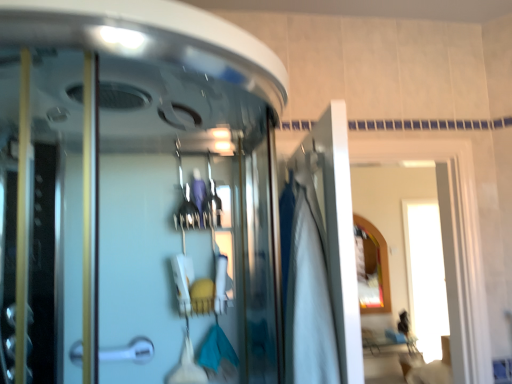
This screenshot has height=384, width=512. What do you see at coordinates (375, 265) in the screenshot? I see `matte gold mirror at upper right` at bounding box center [375, 265].

Where is `transparent glass shower door at center`? transparent glass shower door at center is located at coordinates (131, 216).

From the picture: What is the approximate width of white fabric at center?

5.36 inches.

Identify the location of matte gold mirror at upper right. The image size is (512, 384). (375, 265).

Considering the relative sizes of silver metallic door handle at lower left and matte gold mirror at upper right in the image provided, is silver metallic door handle at lower left thinner than matte gold mirror at upper right?

No, silver metallic door handle at lower left is not thinner than matte gold mirror at upper right.

Considering the relative sizes of silver metallic door handle at lower left and matte gold mirror at upper right in the image provided, is silver metallic door handle at lower left shorter than matte gold mirror at upper right?

Correct, silver metallic door handle at lower left is not as tall as matte gold mirror at upper right.

From the image's perspective, which one is positioned higher, silver metallic door handle at lower left or matte gold mirror at upper right?

silver metallic door handle at lower left is shown above in the image.

Can matte gold mirror at upper right be found inside silver metallic door handle at lower left?

No, matte gold mirror at upper right is not surrounded by silver metallic door handle at lower left.

Can you confirm if white glossy door at upper right is wider than matte gold mirror at upper right?

Yes, white glossy door at upper right is wider than matte gold mirror at upper right.

Is white glossy door at upper right shorter than matte gold mirror at upper right?

Yes.

Based on the photo, is white glossy door at upper right to the left or to the right of matte gold mirror at upper right in the image?

white glossy door at upper right is to the left of matte gold mirror at upper right.

Can you confirm if white fabric at center is shorter than matte gold mirror at upper right?

Correct, white fabric at center is not as tall as matte gold mirror at upper right.

Is point (319, 323) in front of point (355, 216)?

Yes, point (319, 323) is closer to viewer.

Between white fabric at center and matte gold mirror at upper right, which one has larger width?

Wider between the two is white fabric at center.

From the image's perspective, who appears lower, white fabric at center or matte gold mirror at upper right?

matte gold mirror at upper right appears lower in the image.

Is white fabric at center taller than silver metallic door handle at lower left?

Indeed, white fabric at center has a greater height compared to silver metallic door handle at lower left.

Is white fabric at center not within silver metallic door handle at lower left?

white fabric at center is positioned outside silver metallic door handle at lower left.

Is point (353, 280) closer or farther from the camera than point (111, 350)?

Clearly, point (353, 280) is closer to the camera than point (111, 350).

From a real-world perspective, relative to silver metallic door handle at lower left, is white fabric at center vertically above or below?

In terms of real-world spatial position, white fabric at center is above silver metallic door handle at lower left.

Considering the relative positions of matte gold mirror at upper right and transparent glass shower door at center in the image provided, is matte gold mirror at upper right to the left of transparent glass shower door at center from the viewer's perspective?

No, matte gold mirror at upper right is not to the left of transparent glass shower door at center.

Is point (374, 255) farther from viewer compared to point (33, 328)?

That is True.

Which of these two, matte gold mirror at upper right or transparent glass shower door at center, is thinner?

Thinner between the two is matte gold mirror at upper right.

Based on the photo, can you confirm if white glossy door at upper right is thinner than silver metallic door handle at lower left?

No, white glossy door at upper right is not thinner than silver metallic door handle at lower left.

Based on the photo, in terms of size, does white glossy door at upper right appear bigger or smaller than silver metallic door handle at lower left?

In the image, white glossy door at upper right appears to be larger than silver metallic door handle at lower left.

Is silver metallic door handle at lower left at the back of white glossy door at upper right?

That's not correct — white glossy door at upper right is not looking away from silver metallic door handle at lower left.

Does white glossy door at upper right contain silver metallic door handle at lower left?

No, silver metallic door handle at lower left is located outside of white glossy door at upper right.

Is white fabric at center in front of transparent glass shower door at center?

No, white fabric at center is behind transparent glass shower door at center.

From a real-world perspective, who is located lower, white fabric at center or transparent glass shower door at center?

white fabric at center, from a real-world perspective.

Is white fabric at center not near transparent glass shower door at center?

white fabric at center is near transparent glass shower door at center, not far away.

How far apart are white fabric at center and transparent glass shower door at center?

white fabric at center is 18.34 inches away from transparent glass shower door at center.

Image resolution: width=512 pixels, height=384 pixels. Find the location of `door handle located underneath the matte gold mirror at upper right (from a real-world perspective)`. door handle located underneath the matte gold mirror at upper right (from a real-world perspective) is located at coordinates (129, 351).

The height and width of the screenshot is (384, 512). In the image, there is a white glossy door at upper right. What are the coordinates of `mirror below it (from the image's perspective)` in the screenshot? It's located at (375, 265).

Estimate the real-world distances between objects in this image. Which object is further from transparent glass shower door at center, white fabric at center or matte gold mirror at upper right?

matte gold mirror at upper right.

From the image, which object appears to be farther from matte gold mirror at upper right, white fabric at center or transparent glass shower door at center?

The object further to matte gold mirror at upper right is white fabric at center.

Based on their spatial positions, is silver metallic door handle at lower left or white fabric at center closer to transparent glass shower door at center?

white fabric at center lies closer to transparent glass shower door at center than the other object.

When comparing their distances from silver metallic door handle at lower left, does transparent glass shower door at center or white glossy door at upper right seem further?

Among the two, white glossy door at upper right is located further to silver metallic door handle at lower left.

When comparing their distances from transparent glass shower door at center, does white fabric at center or white glossy door at upper right seem further?

Among the two, white glossy door at upper right is located further to transparent glass shower door at center.

In the scene shown: Which object lies nearer to the anchor point silver metallic door handle at lower left, white fabric at center or matte gold mirror at upper right?

Based on the image, white fabric at center appears to be nearer to silver metallic door handle at lower left.

Looking at the image, which one is located closer to transparent glass shower door at center, silver metallic door handle at lower left or matte gold mirror at upper right?

silver metallic door handle at lower left is positioned closer to the anchor transparent glass shower door at center.

Which object lies further to the anchor point white glossy door at upper right, silver metallic door handle at lower left or white fabric at center?

The object further to white glossy door at upper right is white fabric at center.

Image resolution: width=512 pixels, height=384 pixels. In order to click on door between transparent glass shower door at center and matte gold mirror at upper right along the z-axis in this screenshot , I will do pyautogui.click(x=323, y=261).

In order to click on window between transparent glass shower door at center and matte gold mirror at upper right in the front-back direction in this screenshot , I will do `click(445, 249)`.

Locate an element on the screen. This screenshot has width=512, height=384. window located between silver metallic door handle at lower left and matte gold mirror at upper right in the depth direction is located at coordinates (445, 249).

You are a GUI agent. You are given a task and a screenshot of the screen. Output one action in this format:
    pyautogui.click(x=<x>, y=<y>)
    Task: Click on the door situated between silver metallic door handle at lower left and white glossy door at upper right from left to right
    The image size is (512, 384).
    Given the screenshot: What is the action you would take?
    pyautogui.click(x=323, y=261)